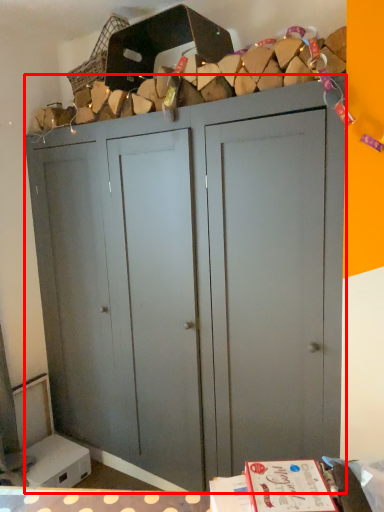
Question: From the image, what is the correct spatial relationship of cupboard (annotated by the red box) in relation to basket?

Choices:
 (A) right
 (B) left

Answer: (A)